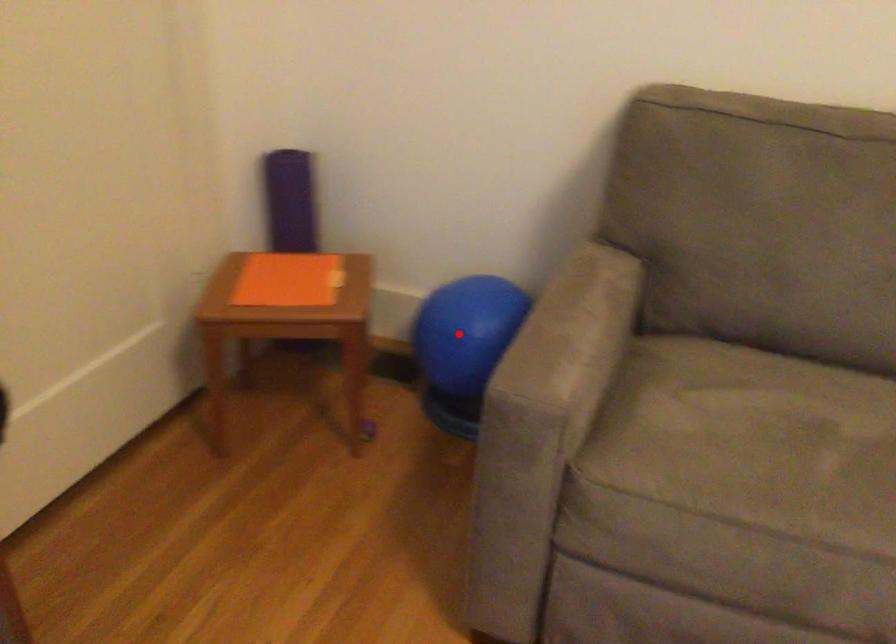
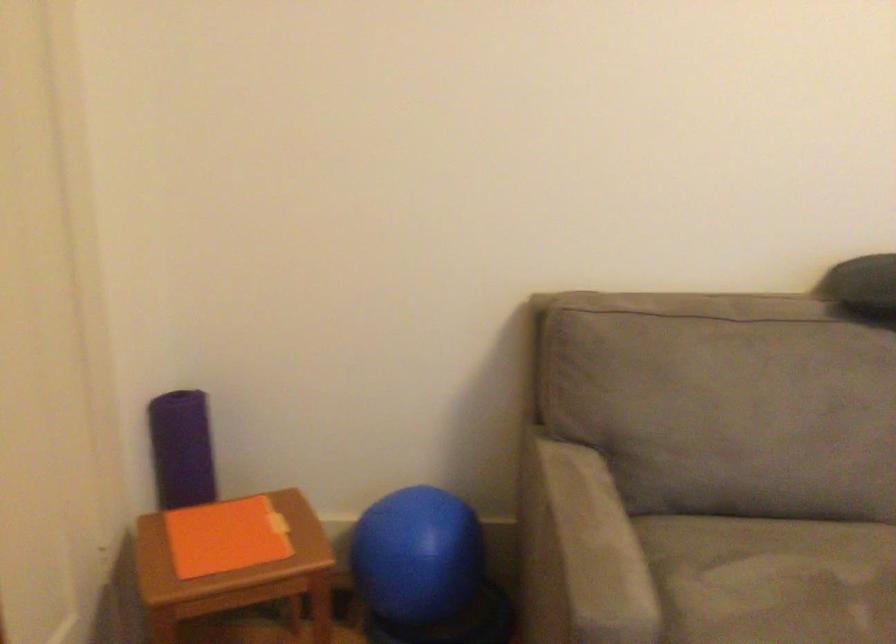
Find the pixel in the second image that matches the highlighted location in the first image.

(417, 554)